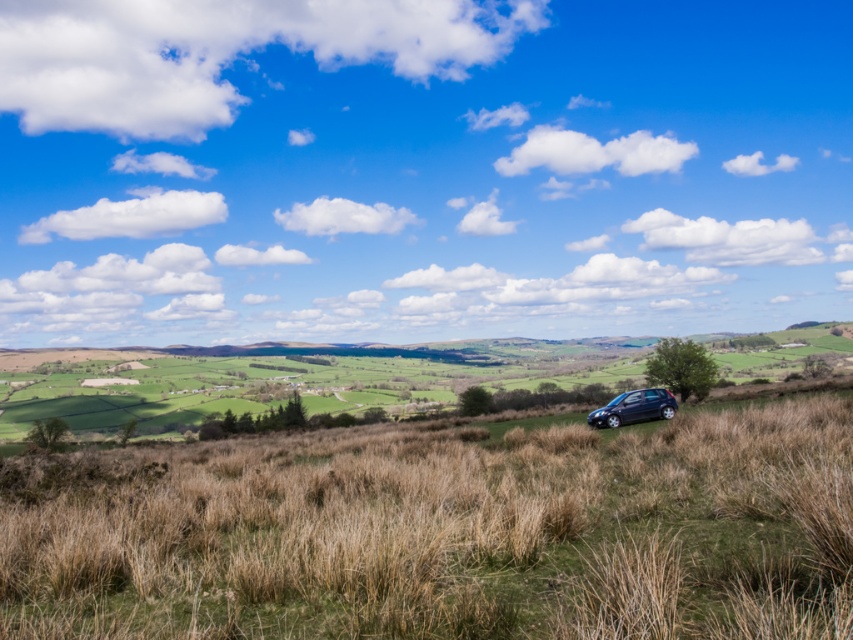
Is point (250, 634) farther from viewer compared to point (645, 400)?

No, it is in front of (645, 400).

Does point (679, 433) come in front of point (653, 397)?

That is True.

Identify the location of dry grass at lower right. (445, 534).